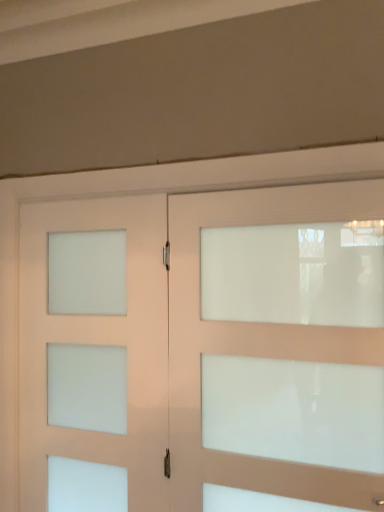
What do you see at coordinates (180, 344) in the screenshot? I see `white frosted glass door at center, acting as the first door starting from the right` at bounding box center [180, 344].

From the picture: How much space does white frosted glass door at center, which appears as the 2th door when viewed from the left, occupy horizontally?

white frosted glass door at center, which appears as the 2th door when viewed from the left, is 5.13 inches wide.

What is the approximate height of white frosted glass door at center, which appears as the 2th door when viewed from the left?

The height of white frosted glass door at center, which appears as the 2th door when viewed from the left, is 1.19 meters.

Locate an element on the screen. The height and width of the screenshot is (512, 384). white frosted glass door at center, which appears as the 2th door when viewed from the left is located at coordinates (180, 344).

The height and width of the screenshot is (512, 384). Find the location of `white frosted glass door at left, which ranks as the 2th door in right-to-left order`. white frosted glass door at left, which ranks as the 2th door in right-to-left order is located at coordinates (97, 343).

Image resolution: width=384 pixels, height=512 pixels. What do you see at coordinates (97, 343) in the screenshot? I see `white frosted glass door at left, the 1th door positioned from the left` at bounding box center [97, 343].

Where is `white frosted glass door at center, acting as the first door starting from the right`? white frosted glass door at center, acting as the first door starting from the right is located at coordinates pyautogui.click(x=180, y=344).

Can you confirm if white frosted glass door at left, the 1th door positioned from the left, is positioned to the left of white frosted glass door at center, which appears as the 2th door when viewed from the left?

Correct, you'll find white frosted glass door at left, the 1th door positioned from the left, to the left of white frosted glass door at center, which appears as the 2th door when viewed from the left.

Which object is more forward, white frosted glass door at left, the 1th door positioned from the left, or white frosted glass door at center, acting as the first door starting from the right?

white frosted glass door at center, acting as the first door starting from the right, is more forward.

Which point is more forward, (132, 474) or (160, 456)?

The point (160, 456) is in front.

From the image's perspective, is white frosted glass door at left, which ranks as the 2th door in right-to-left order, above white frosted glass door at center, which appears as the 2th door when viewed from the left?

Incorrect, from the image's perspective, white frosted glass door at left, which ranks as the 2th door in right-to-left order, is lower than white frosted glass door at center, which appears as the 2th door when viewed from the left.

From a real-world perspective, is white frosted glass door at left, which ranks as the 2th door in right-to-left order, on top of white frosted glass door at center, acting as the first door starting from the right?

No, from a real-world perspective, white frosted glass door at left, which ranks as the 2th door in right-to-left order, is not over white frosted glass door at center, acting as the first door starting from the right

Which object is wider, white frosted glass door at left, the 1th door positioned from the left, or white frosted glass door at center, which appears as the 2th door when viewed from the left?

white frosted glass door at center, which appears as the 2th door when viewed from the left.

Is white frosted glass door at left, the 1th door positioned from the left, taller than white frosted glass door at center, acting as the first door starting from the right?

Yes.

Based on their sizes in the image, would you say white frosted glass door at left, which ranks as the 2th door in right-to-left order, is bigger or smaller than white frosted glass door at center, which appears as the 2th door when viewed from the left?

white frosted glass door at left, which ranks as the 2th door in right-to-left order, is smaller than white frosted glass door at center, which appears as the 2th door when viewed from the left.

From the picture: Would you say white frosted glass door at left, which ranks as the 2th door in right-to-left order, contains white frosted glass door at center, which appears as the 2th door when viewed from the left?

Definitely not — white frosted glass door at center, which appears as the 2th door when viewed from the left, is not inside white frosted glass door at left, which ranks as the 2th door in right-to-left order.

Is white frosted glass door at left, the 1th door positioned from the left, in contact with white frosted glass door at center, acting as the first door starting from the right?

Yes, white frosted glass door at left, the 1th door positioned from the left, and white frosted glass door at center, acting as the first door starting from the right, clearly make contact.

Is white frosted glass door at left, which ranks as the 2th door in right-to-left order, positioned with its back to white frosted glass door at center, which appears as the 2th door when viewed from the left?

That's not correct — white frosted glass door at left, which ranks as the 2th door in right-to-left order, is not looking away from white frosted glass door at center, which appears as the 2th door when viewed from the left.

What's the angular difference between white frosted glass door at left, the 1th door positioned from the left, and white frosted glass door at center, which appears as the 2th door when viewed from the left,'s facing directions?

0.00136 degrees separate the facing orientations of white frosted glass door at left, the 1th door positioned from the left, and white frosted glass door at center, which appears as the 2th door when viewed from the left.

How distant is white frosted glass door at left, which ranks as the 2th door in right-to-left order, from white frosted glass door at center, which appears as the 2th door when viewed from the left?

white frosted glass door at left, which ranks as the 2th door in right-to-left order, and white frosted glass door at center, which appears as the 2th door when viewed from the left, are 3.49 inches apart.

Locate an element on the screen. The image size is (384, 512). door located in front of the white frosted glass door at left, the 1th door positioned from the left is located at coordinates (180, 344).

Considering the relative positions of white frosted glass door at center, acting as the first door starting from the right, and white frosted glass door at left, which ranks as the 2th door in right-to-left order, in the image provided, is white frosted glass door at center, acting as the first door starting from the right, to the right of white frosted glass door at left, which ranks as the 2th door in right-to-left order, from the viewer's perspective?

Yes, white frosted glass door at center, acting as the first door starting from the right, is to the right of white frosted glass door at left, which ranks as the 2th door in right-to-left order.

In the image, is white frosted glass door at center, acting as the first door starting from the right, positioned in front of or behind white frosted glass door at left, the 1th door positioned from the left?

Clearly, white frosted glass door at center, acting as the first door starting from the right, is in front of white frosted glass door at left, the 1th door positioned from the left.

Does point (88, 226) lie in front of point (117, 325)?

No, (88, 226) is behind (117, 325).

From the image's perspective, which one is positioned higher, white frosted glass door at center, acting as the first door starting from the right, or white frosted glass door at left, the 1th door positioned from the left?

white frosted glass door at center, acting as the first door starting from the right, is shown above in the image.

From a real-world perspective, between white frosted glass door at center, acting as the first door starting from the right, and white frosted glass door at left, the 1th door positioned from the left, who is vertically lower?

From a 3D spatial view, white frosted glass door at left, the 1th door positioned from the left, is below.

Is white frosted glass door at center, which appears as the 2th door when viewed from the left, thinner than white frosted glass door at left, which ranks as the 2th door in right-to-left order?

No, white frosted glass door at center, which appears as the 2th door when viewed from the left, is not thinner than white frosted glass door at left, which ranks as the 2th door in right-to-left order.

Between white frosted glass door at center, which appears as the 2th door when viewed from the left, and white frosted glass door at left, the 1th door positioned from the left, which one has more height?

white frosted glass door at left, the 1th door positioned from the left, is taller.

Who is smaller, white frosted glass door at center, which appears as the 2th door when viewed from the left, or white frosted glass door at left, the 1th door positioned from the left?

With smaller size is white frosted glass door at left, the 1th door positioned from the left.

Is white frosted glass door at center, which appears as the 2th door when viewed from the left, spatially inside white frosted glass door at left, which ranks as the 2th door in right-to-left order, or outside of it?

white frosted glass door at center, which appears as the 2th door when viewed from the left, lies outside white frosted glass door at left, which ranks as the 2th door in right-to-left order.

Would you consider white frosted glass door at center, acting as the first door starting from the right, to be distant from white frosted glass door at left, which ranks as the 2th door in right-to-left order?

No, white frosted glass door at center, acting as the first door starting from the right, is in close proximity to white frosted glass door at left, which ranks as the 2th door in right-to-left order.

Is white frosted glass door at center, acting as the first door starting from the right, turned away from white frosted glass door at left, which ranks as the 2th door in right-to-left order?

white frosted glass door at center, acting as the first door starting from the right, does not have its back to white frosted glass door at left, which ranks as the 2th door in right-to-left order.

Can you tell me how much white frosted glass door at center, acting as the first door starting from the right, and white frosted glass door at left, which ranks as the 2th door in right-to-left order, differ in facing direction?

0.00136 degrees separate the facing orientations of white frosted glass door at center, acting as the first door starting from the right, and white frosted glass door at left, which ranks as the 2th door in right-to-left order.

How much distance is there between white frosted glass door at center, acting as the first door starting from the right, and white frosted glass door at left, the 1th door positioned from the left?

white frosted glass door at center, acting as the first door starting from the right, is 3.49 inches away from white frosted glass door at left, the 1th door positioned from the left.

The image size is (384, 512). In order to click on door below the white frosted glass door at center, acting as the first door starting from the right (from the image's perspective) in this screenshot , I will do `click(97, 343)`.

The width and height of the screenshot is (384, 512). I want to click on door below the white frosted glass door at center, acting as the first door starting from the right (from the image's perspective), so click(x=97, y=343).

At what (x,y) coordinates should I click in order to perform the action: click on door that appears above the white frosted glass door at left, which ranks as the 2th door in right-to-left order (from the image's perspective). Please return your answer as a coordinate pair (x, y). Looking at the image, I should click on (180, 344).